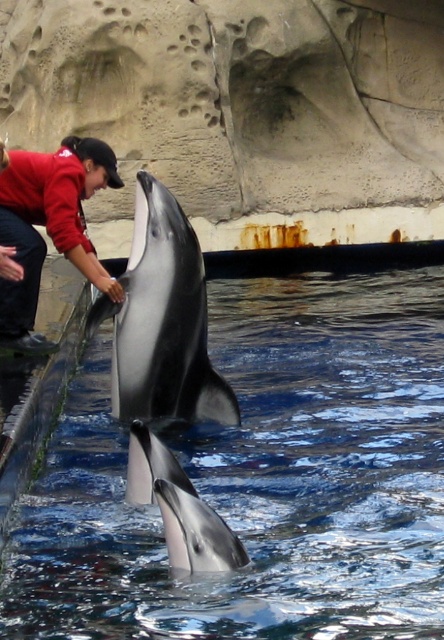
Question: Can you confirm if clear blue water at dolphin center is positioned to the left of red cotton shirt at left?

Choices:
 (A) yes
 (B) no

Answer: (B)

Question: Is black smooth dolphin at center thinner than shiny silver dolphin at center?

Choices:
 (A) yes
 (B) no

Answer: (B)

Question: Which point appears farthest from the camera in this image?

Choices:
 (A) (139, 616)
 (B) (19, 182)

Answer: (B)

Question: Which object appears closest to the camera in this image?

Choices:
 (A) shiny silver dolphin at center
 (B) clear blue water at dolphin center
 (C) red cotton shirt at left
 (D) black smooth dolphin at center

Answer: (A)

Question: Which point is farther from the camera taking this photo?

Choices:
 (A) (104, 566)
 (B) (171, 214)
 (C) (80, 176)
 (D) (249, 557)

Answer: (C)

Question: Is black smooth dolphin at center positioned in front of shiny silver dolphin at center?

Choices:
 (A) yes
 (B) no

Answer: (B)